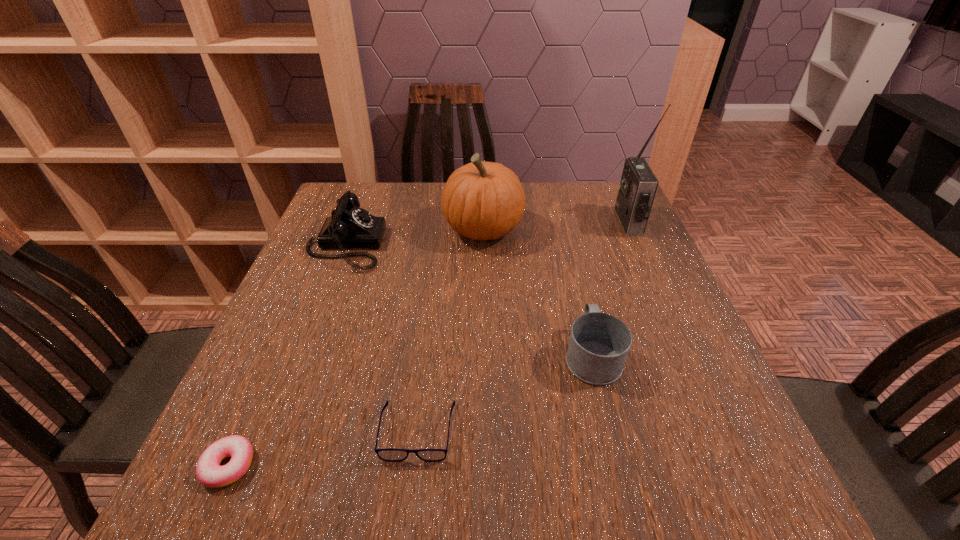
At what (x,y) coordinates should I click in order to perform the action: click on object that is positioned at the far right corner. Please return your answer as a coordinate pair (x, y). The width and height of the screenshot is (960, 540). Looking at the image, I should click on (638, 185).

The image size is (960, 540). Find the location of `vacant region at the far edge`. vacant region at the far edge is located at coordinates (532, 192).

You are a GUI agent. You are given a task and a screenshot of the screen. Output one action in this format:
    pyautogui.click(x=<x>, y=<y>)
    Task: Click on the free space at the near edge of the desktop
    This screenshot has width=960, height=540.
    Given the screenshot: What is the action you would take?
    pyautogui.click(x=517, y=485)

Find the location of `free space at the left edge`. free space at the left edge is located at coordinates (292, 301).

The image size is (960, 540). I want to click on vacant space at the right edge, so click(732, 417).

Image resolution: width=960 pixels, height=540 pixels. I want to click on free location at the far left corner of the desktop, so click(377, 201).

The height and width of the screenshot is (540, 960). I want to click on free space at the far right corner of the desktop, so (611, 212).

Locate an element on the screen. Image resolution: width=960 pixels, height=540 pixels. vacant area at the near right corner is located at coordinates (732, 460).

Find the location of a particular element. blank region between the doughnut and the third tallest object is located at coordinates (x=287, y=355).

The height and width of the screenshot is (540, 960). Identify the location of vacant area that lies between the radio receiver and the spectacles. click(523, 327).